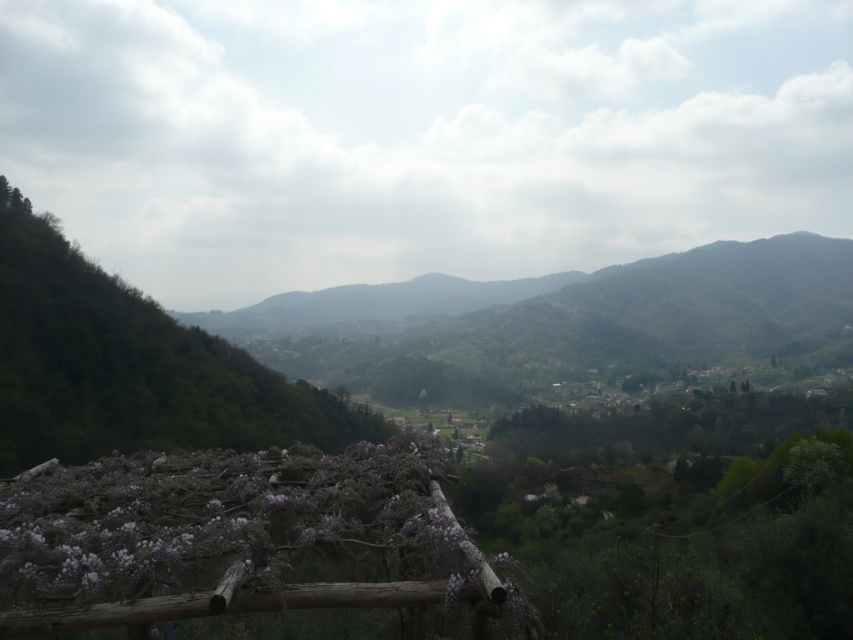
Question: Does purple wood trellis at lower left have a larger size compared to green leafy tree at left?

Choices:
 (A) no
 (B) yes

Answer: (A)

Question: Which object is positioned closest to the green leafy tree at left?

Choices:
 (A) purple wood trellis at lower left
 (B) green leafy mountain at center

Answer: (B)

Question: Which point appears closest to the camera in this image?

Choices:
 (A) (138, 564)
 (B) (431, 387)

Answer: (A)

Question: Which is farther from the green leafy tree at left?

Choices:
 (A) purple wood trellis at lower left
 (B) green leafy mountain at center

Answer: (A)

Question: Does purple wood trellis at lower left lie behind green leafy tree at left?

Choices:
 (A) yes
 (B) no

Answer: (B)

Question: Does purple wood trellis at lower left have a lesser width compared to green leafy tree at left?

Choices:
 (A) no
 (B) yes

Answer: (B)